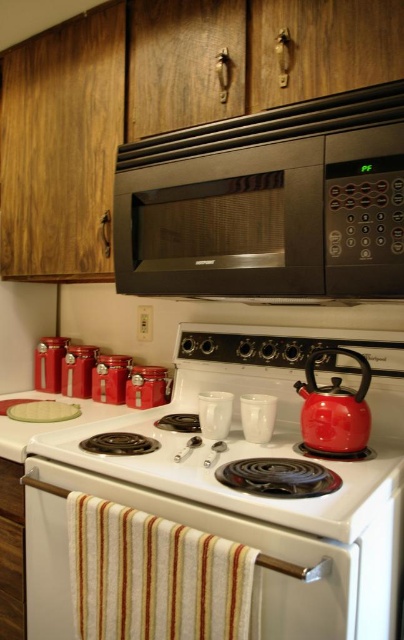
You are trying to place a tall cooking pot on the counter between the white glossy stove at center and the black matte microwave at upper center. Considering their heights, which appliance should you place the pot closer to so it doesn

The white glossy stove at center is taller than the black matte microwave at upper center, so you should place the tall cooking pot closer to the white glossy stove at center to ensure stability and avoid blocking the microwave.

You are standing in the kitchen and need to place a new mug on the counter next to the shiny red teapot at stove top. Where should you place it?

The shiny red teapot at stove top is located at point (334, 408), so you should place the new mug near those coordinates on the counter.